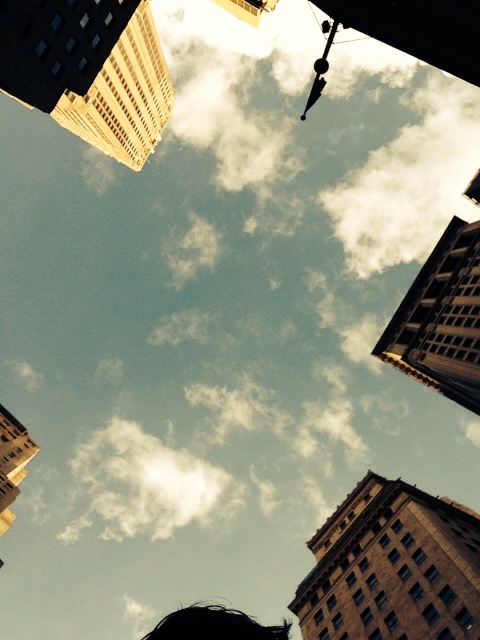
The width and height of the screenshot is (480, 640). What do you see at coordinates (145, 484) in the screenshot?
I see `white fluffy cloud at center` at bounding box center [145, 484].

Can you confirm if white fluffy cloud at center is positioned below black hair at lower center?

Correct, white fluffy cloud at center is located below black hair at lower center.

The height and width of the screenshot is (640, 480). What do you see at coordinates (145, 484) in the screenshot? I see `white fluffy cloud at center` at bounding box center [145, 484].

The height and width of the screenshot is (640, 480). Find the location of `white fluffy cloud at center`. white fluffy cloud at center is located at coordinates (145, 484).